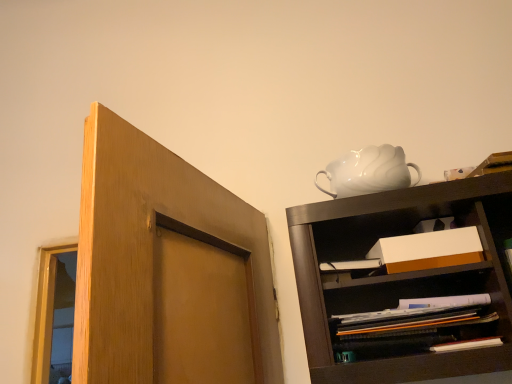
This screenshot has height=384, width=512. Describe the element at coordinates (368, 172) in the screenshot. I see `white glossy teapot at upper right` at that location.

What is the approximate height of matte brown shelf at lower right?

5.13 inches.

You are a GUI agent. You are given a task and a screenshot of the screen. Output one action in this format:
    pyautogui.click(x=<x>, y=<y>)
    Task: Click on the white glossy teapot at upper right
    The width and height of the screenshot is (512, 384).
    Given the screenshot: What is the action you would take?
    pyautogui.click(x=368, y=172)

Locate an element on the screen. tea pot that appears on the left of matte brown shelf at lower right is located at coordinates (368, 172).

Is white glossy teapot at upper right far away from matte brown shelf at lower right?

Actually, white glossy teapot at upper right and matte brown shelf at lower right are a little close together.

Is white glossy teapot at upper right positioned beyond the bounds of matte brown shelf at lower right?

That's correct, white glossy teapot at upper right is outside of matte brown shelf at lower right.

Is matte brown shelf at lower right facing towards white glossy teapot at upper right?

No, matte brown shelf at lower right is not turned towards white glossy teapot at upper right.

Can you tell me how much matte brown shelf at lower right and white glossy teapot at upper right differ in facing direction?

6.37 degrees separate the facing orientations of matte brown shelf at lower right and white glossy teapot at upper right.

Could white glossy teapot at upper right be considered to be inside matte brown shelf at lower right?

That's incorrect, white glossy teapot at upper right is not inside matte brown shelf at lower right.

Is matte brown shelf at lower right far away from white glossy teapot at upper right?

No.

Does white glossy teapot at upper right come in front of white cardboard box at center?

No, white glossy teapot at upper right is further to the viewer.

Considering the points (346, 196) and (432, 237), which point is in front, point (346, 196) or point (432, 237)?

The point (432, 237) is closer.

From a real-world perspective, is white glossy teapot at upper right located higher than white cardboard box at center?

Yes.

From the image's perspective, is white glossy teapot at upper right above white cardboard box at center?

Yes, from the image's perspective, white glossy teapot at upper right is above white cardboard box at center.

This screenshot has width=512, height=384. Identify the location of cabinet located behind the matte brown shelf at lower right. (411, 256).

How far apart are matte brown shelf at lower right and white cardboard box at center?

matte brown shelf at lower right is 3.09 inches away from white cardboard box at center.

Can you confirm if matte brown shelf at lower right is taller than white cardboard box at center?

Indeed, matte brown shelf at lower right has a greater height compared to white cardboard box at center.

In the scene shown: From a real-world perspective, is matte brown shelf at lower right below white cardboard box at center?

Yes, from a real-world perspective, matte brown shelf at lower right is beneath white cardboard box at center.

Does white cardboard box at center contain matte brown shelf at lower right?

No, white cardboard box at center does not contain matte brown shelf at lower right.

Considering the sizes of objects white cardboard box at center and matte brown shelf at lower right in the image provided, who is wider, white cardboard box at center or matte brown shelf at lower right?

With larger width is matte brown shelf at lower right.

Is white cardboard box at center with matte brown shelf at lower right?

Yes, white cardboard box at center is beside matte brown shelf at lower right.

Looking at this image, which is closer, (457, 260) or (454, 274)?

Clearly, point (457, 260) is closer to the camera than point (454, 274).

From a real-world perspective, is white cardboard box at center on white glossy teapot at upper right?

No, from a real-world perspective, white cardboard box at center is not on top of white glossy teapot at upper right.

The width and height of the screenshot is (512, 384). I want to click on cabinet that appears below the white glossy teapot at upper right (from a real-world perspective), so click(411, 256).

Is white cardboard box at center oriented towards white glossy teapot at upper right?

No, white cardboard box at center is not oriented towards white glossy teapot at upper right.

From the image's perspective, would you say white cardboard box at center is positioned over white glossy teapot at upper right?

Incorrect, from the image's perspective, white cardboard box at center is lower than white glossy teapot at upper right.

Locate an element on the screen. tea pot above the matte brown shelf at lower right (from a real-world perspective) is located at coordinates (368, 172).

Locate an element on the screen. The image size is (512, 384). shelf below the white glossy teapot at upper right (from the image's perspective) is located at coordinates (419, 290).

Based on their spatial positions, is matte brown shelf at lower right or white glossy teapot at upper right further from white cardboard box at center?

Based on the image, white glossy teapot at upper right appears to be further to white cardboard box at center.

From the image, which object appears to be nearer to white cardboard box at center, white glossy teapot at upper right or matte brown shelf at lower right?

matte brown shelf at lower right is positioned closer to the anchor white cardboard box at center.

Based on their spatial positions, is white cardboard box at center or white glossy teapot at upper right closer to matte brown shelf at lower right?

Based on the image, white cardboard box at center appears to be nearer to matte brown shelf at lower right.

When comparing their distances from white glossy teapot at upper right, does white cardboard box at center or matte brown shelf at lower right seem closer?

white cardboard box at center lies closer to white glossy teapot at upper right than the other object.

Looking at the image, which one is located further to white glossy teapot at upper right, matte brown shelf at lower right or white cardboard box at center?

matte brown shelf at lower right is positioned further to the anchor white glossy teapot at upper right.

From the image, which object appears to be farther from matte brown shelf at lower right, white glossy teapot at upper right or white cardboard box at center?

Among the two, white glossy teapot at upper right is located further to matte brown shelf at lower right.

The image size is (512, 384). Find the location of `cabinet between white glossy teapot at upper right and matte brown shelf at lower right in the up-down direction`. cabinet between white glossy teapot at upper right and matte brown shelf at lower right in the up-down direction is located at coordinates (411, 256).